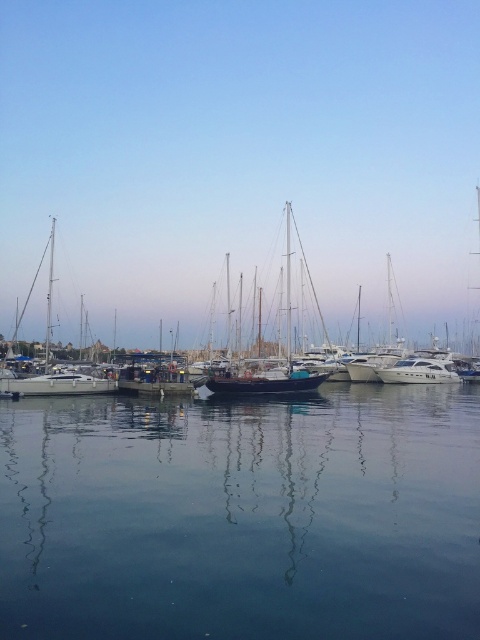
You are standing at the edge of the marina and want to know how far the point at coordinates (441,573) is from your current position. Based on the scene, can you determine the distance?

The point at coordinates (441,573) is 6.71 meters away from the camera, so it is 6.71 meters away from your current position.

You are standing at the edge of the marina and want to take a photo of the clear blue water at center. Which direction should you point your camera to capture it?

The clear blue water at center is located at point coordinates of 0.808 on the x axis and 0.504 on the y axis, so you should point your camera towards the center of the marina to capture it.